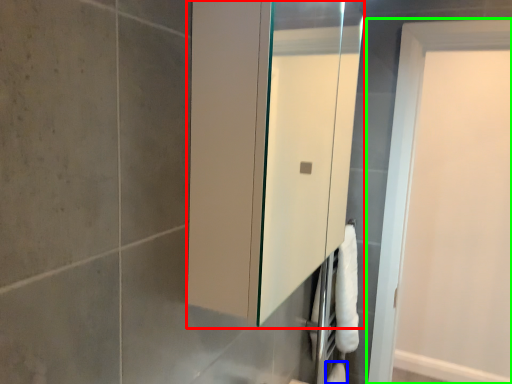
Question: Based on their relative distances, which object is nearer to medicine cabinet (highlighted by a red box)? Choose from toilet paper (highlighted by a blue box) and door (highlighted by a green box).

Choices:
 (A) toilet paper
 (B) door

Answer: (B)